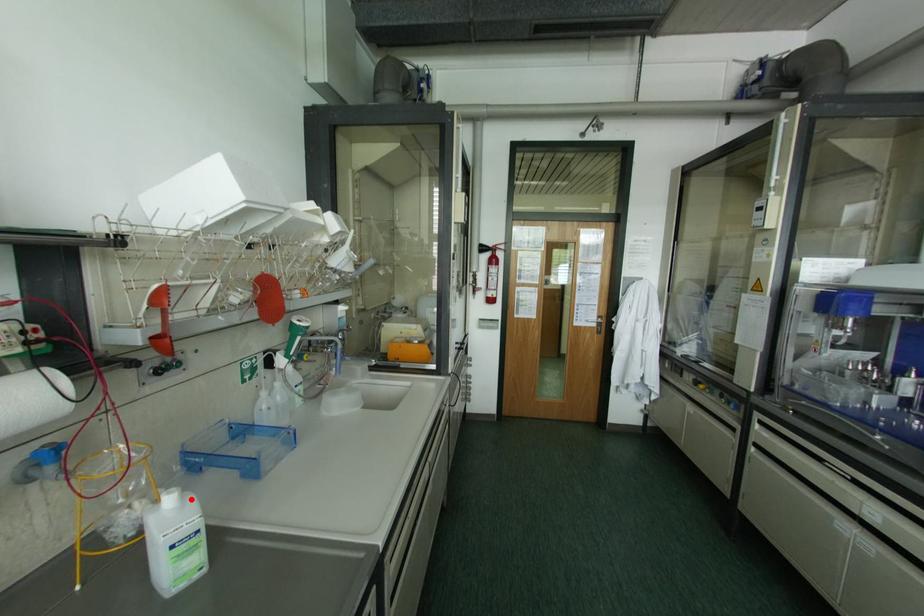
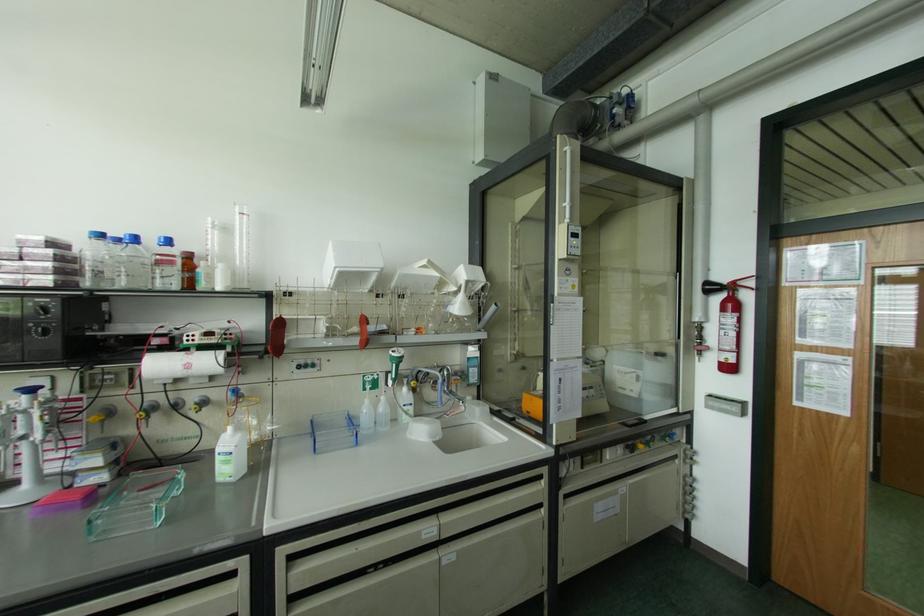
In the second image, find the point that corresponds to the highlighted location in the first image.

(238, 435)